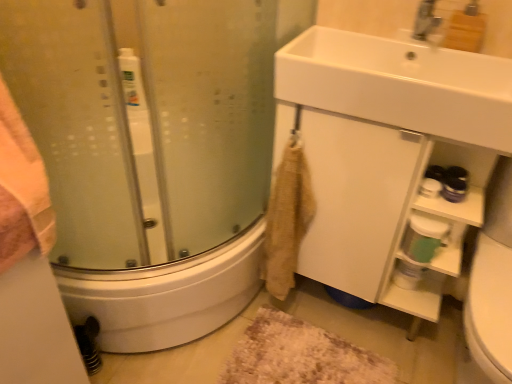
Question: Is beige textured towel at lower center bigger than green plastic container at lower right?

Choices:
 (A) no
 (B) yes

Answer: (B)

Question: Is beige textured towel at lower center oriented away from green plastic container at lower right?

Choices:
 (A) yes
 (B) no

Answer: (B)

Question: Are beige textured towel at lower center and green plastic container at lower right beside each other?

Choices:
 (A) no
 (B) yes

Answer: (A)

Question: Is the position of beige textured towel at lower center less distant than that of green plastic container at lower right?

Choices:
 (A) no
 (B) yes

Answer: (B)

Question: From a real-world perspective, is beige textured towel at lower center physically above green plastic container at lower right?

Choices:
 (A) yes
 (B) no

Answer: (B)

Question: Would you say beige textured towel at lower center contains green plastic container at lower right?

Choices:
 (A) yes
 (B) no

Answer: (B)

Question: From a real-world perspective, is white matte cabinet at lower right positioned under beige textured towel at lower center based on gravity?

Choices:
 (A) yes
 (B) no

Answer: (A)

Question: Is white matte cabinet at lower right to the left of beige textured towel at lower center from the viewer's perspective?

Choices:
 (A) no
 (B) yes

Answer: (A)

Question: Is white matte cabinet at lower right taller than beige textured towel at lower center?

Choices:
 (A) no
 (B) yes

Answer: (B)

Question: Is white matte cabinet at lower right aimed at beige textured towel at lower center?

Choices:
 (A) yes
 (B) no

Answer: (A)

Question: Are white matte cabinet at lower right and beige textured towel at lower center located far from each other?

Choices:
 (A) yes
 (B) no

Answer: (B)

Question: Is beige textured towel at lower center inside white matte cabinet at lower right?

Choices:
 (A) no
 (B) yes

Answer: (A)

Question: Can you confirm if green plastic container at lower right is shorter than white matte cabinet at lower right?

Choices:
 (A) no
 (B) yes

Answer: (B)